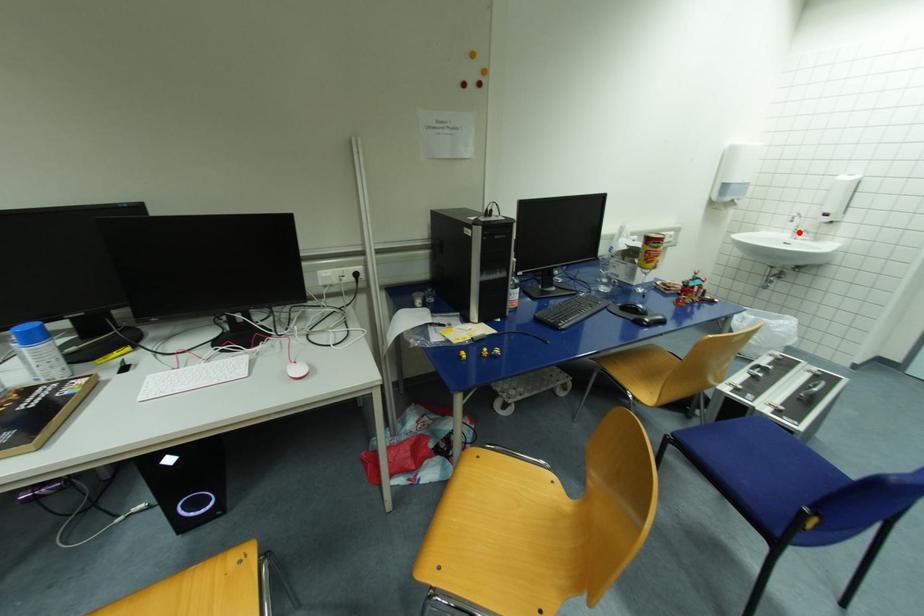
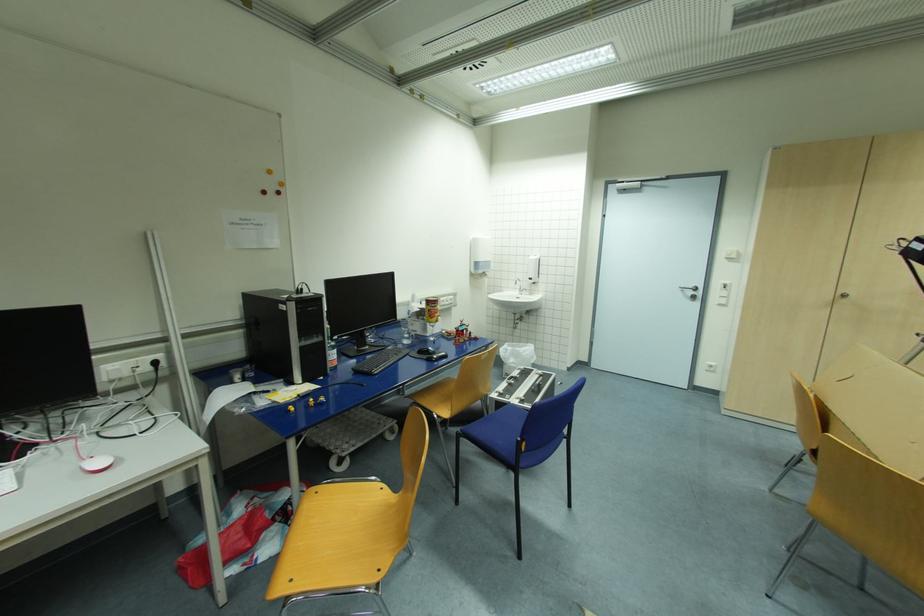
Question: I am providing you with two images of the same scene from different viewpoints. Given a red point in image1, look at the same physical point in image2. Is it:

Choices:
 (A) Closer to the viewpoint
 (B) Farther from the viewpoint

Answer: (A)